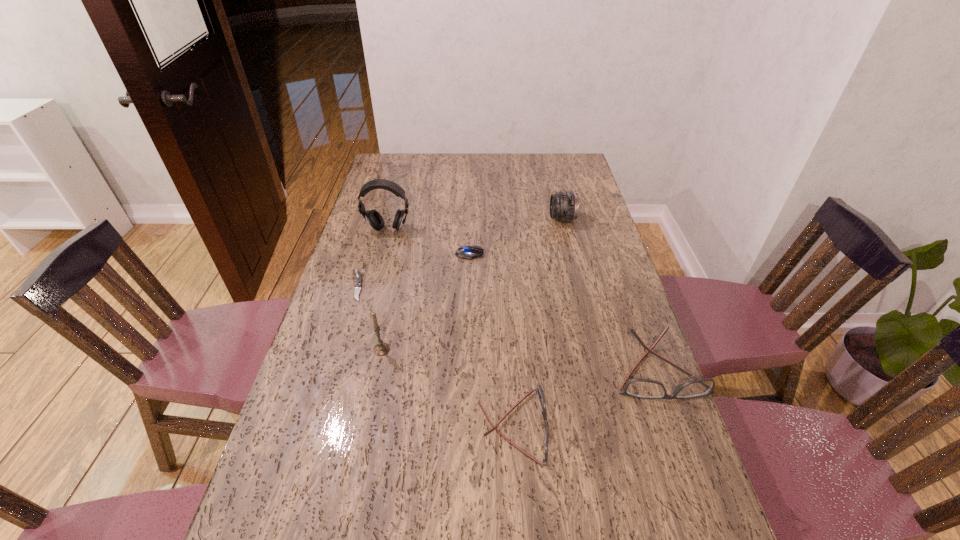
Where is `the shortest object`? the shortest object is located at coordinates (358, 278).

This screenshot has width=960, height=540. Find the location of `vacant position located on the front-facing side of the shorter spectacles`. vacant position located on the front-facing side of the shorter spectacles is located at coordinates (639, 427).

The image size is (960, 540). I want to click on vacant region located 0.120m on the front-facing side of the right spectacles, so click(x=685, y=449).

The width and height of the screenshot is (960, 540). I want to click on free space located at the front element of the fifth shortest object, so click(447, 219).

Identify the location of free location located at the front element of the fifth shortest object. (512, 219).

You are a GUI agent. You are given a task and a screenshot of the screen. Output one action in this format:
    pyautogui.click(x=<x>, y=<y>)
    Task: Click on the vacant space situated 0.140m at the front element of the fifth shortest object
    The image size is (960, 540).
    Given the screenshot: What is the action you would take?
    pos(512,219)

The image size is (960, 540). Identify the location of vacant region located 0.140m on the ear cups of the earphone. (379, 261).

I want to click on vacant point located 0.390m on the back of the second tallest object, so click(x=401, y=253).

Locate an element on the screen. Image resolution: width=960 pixels, height=540 pixels. vacant point located on the button side of the third farthest object is located at coordinates (597, 254).

This screenshot has height=540, width=960. What are the coordinates of `blank area located on the right of the pocketknife` in the screenshot? It's located at (425, 286).